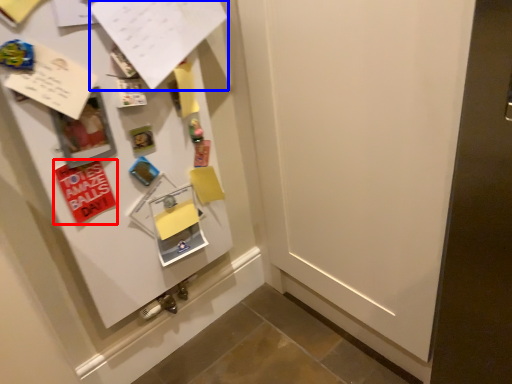
Question: Which object is further to the camera taking this photo, postcard (highlighted by a red box) or paper (highlighted by a blue box)?

Choices:
 (A) postcard
 (B) paper

Answer: (A)